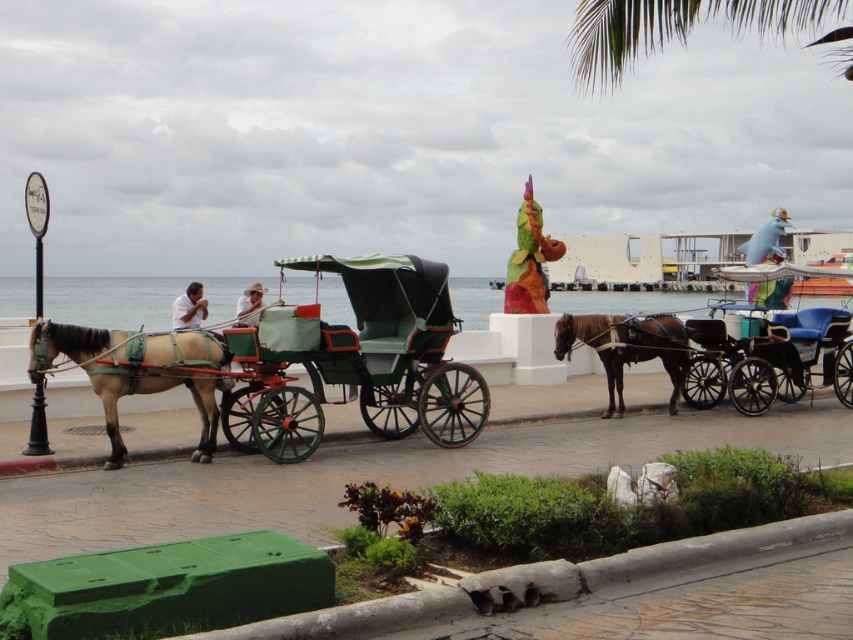
Question: Which of the following is the closest to the observer?

Choices:
 (A) brown glossy horse at center
 (B) brown leather horse at left

Answer: (B)

Question: Which point is farther to the camera?

Choices:
 (A) (804, 269)
 (B) (378, 346)
 (C) (120, 440)
 (D) (177, 310)

Answer: (A)

Question: Can you confirm if green painted wood horse cart at center is thinner than brown leather horse at left?

Choices:
 (A) no
 (B) yes

Answer: (A)

Question: Considering the relative positions of green painted wood horse cart at center and matte green coach at center in the image provided, where is green painted wood horse cart at center located with respect to matte green coach at center?

Choices:
 (A) above
 (B) below

Answer: (B)

Question: Among these points, which one is nearest to the camera?

Choices:
 (A) (317, 410)
 (B) (816, 356)
 (C) (672, 314)

Answer: (A)

Question: Does brown leather horse at left have a greater width compared to matte green coach at center?

Choices:
 (A) yes
 (B) no

Answer: (B)